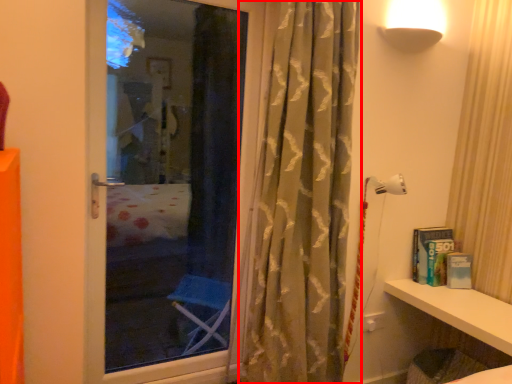
Question: From the image's perspective, what is the correct spatial relationship of curtain (annotated by the red box) in relation to shelf?

Choices:
 (A) above
 (B) below

Answer: (A)